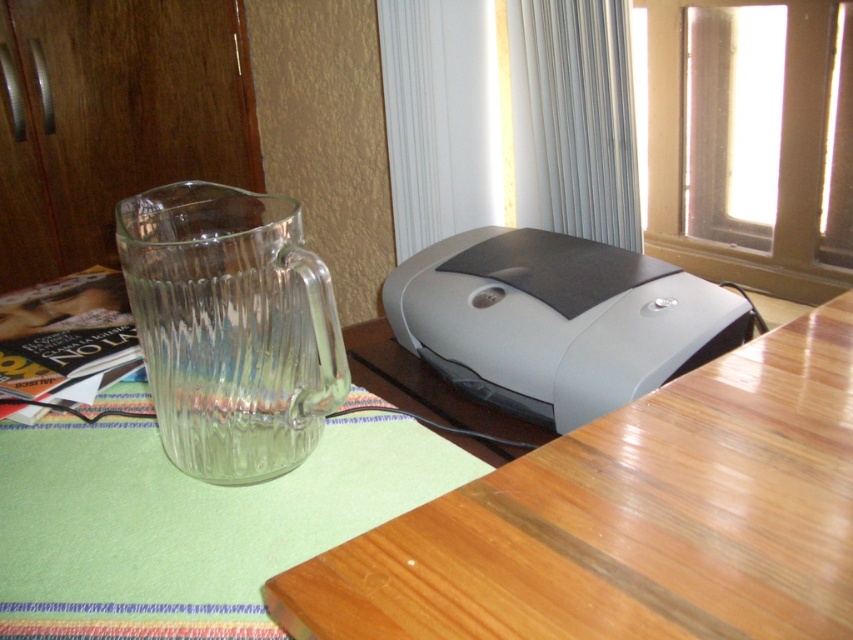
What do you see at coordinates (230, 326) in the screenshot? The image size is (853, 640). I see `clear glass pitcher at lower left` at bounding box center [230, 326].

Who is more distant from viewer, (x=299, y=419) or (x=432, y=337)?

Positioned behind is point (x=432, y=337).

Locate an element on the screen. Image resolution: width=853 pixels, height=640 pixels. clear glass pitcher at lower left is located at coordinates (230, 326).

Is point (587, 608) farther from camera compared to point (433, 346)?

No, (587, 608) is closer to viewer.

Who is shorter, wooden table at upper right or gray matte printer at center?

With less height is wooden table at upper right.

What do you see at coordinates (630, 520) in the screenshot? I see `wooden table at upper right` at bounding box center [630, 520].

Find the location of a particular element. The height and width of the screenshot is (640, 853). wooden table at upper right is located at coordinates (630, 520).

Does wooden table at upper right have a lesser width compared to clear glass pitcher at lower left?

In fact, wooden table at upper right might be wider than clear glass pitcher at lower left.

Is wooden table at upper right taller than clear glass pitcher at lower left?

In fact, wooden table at upper right may be shorter than clear glass pitcher at lower left.

Who is more forward, (670, 598) or (157, 385)?

Point (670, 598) is more forward.

Find the location of a particular element. Image resolution: width=853 pixels, height=640 pixels. wooden table at upper right is located at coordinates (630, 520).